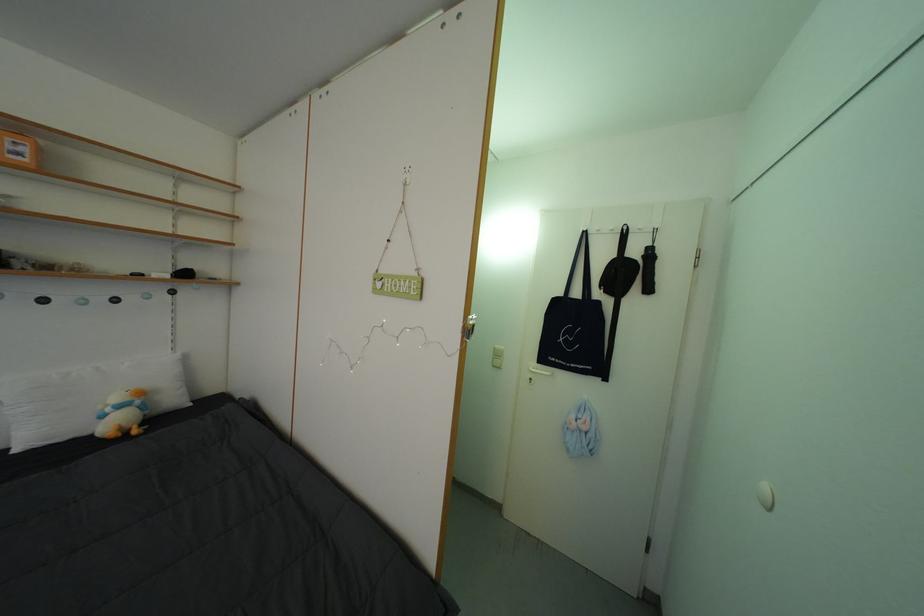
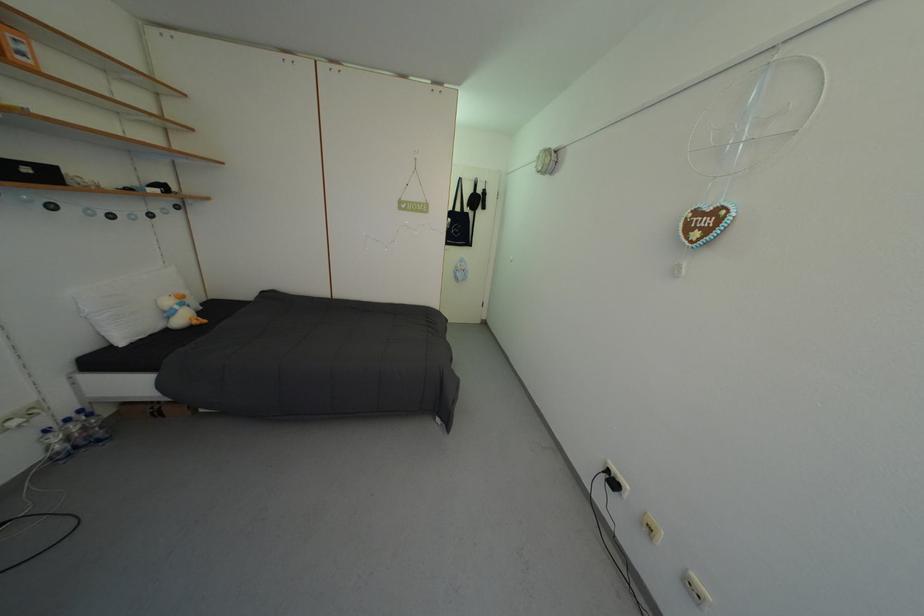
Find the pixel in the second image that matches [27,160] in the first image.

(30, 60)